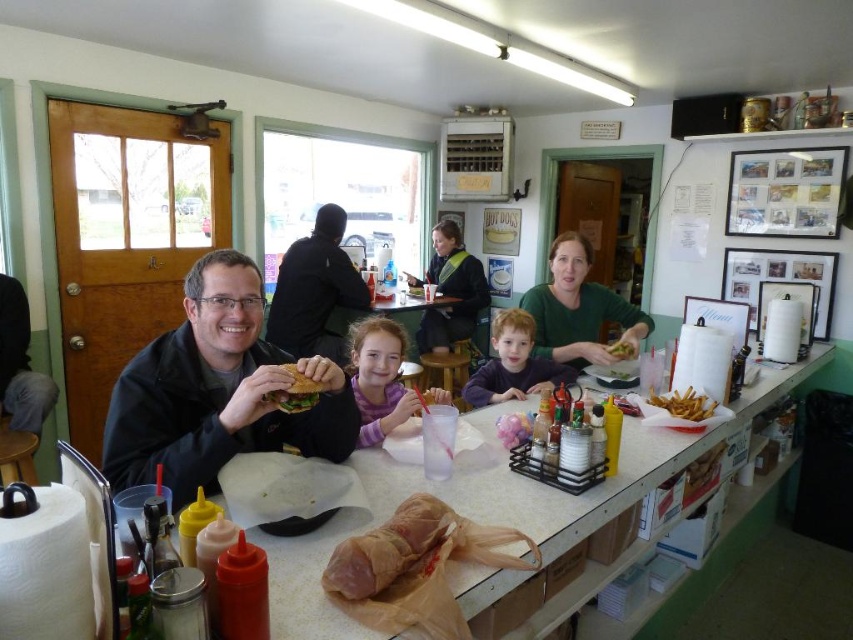
Question: Considering the relative positions of golden crispy fries at counter and matte green sandwich at center in the image provided, where is golden crispy fries at counter located with respect to matte green sandwich at center?

Choices:
 (A) below
 (B) above

Answer: (A)

Question: Which object is positioned closest to the matte brown sandwich at center?

Choices:
 (A) green fabric vest at center
 (B) matte green lettuce at center
 (C) translucent plastic bag at center
 (D) purple cotton shirt at center

Answer: (B)

Question: Which object is farther from the camera taking this photo?

Choices:
 (A) black matte jacket at center
 (B) green fabric vest at center

Answer: (B)

Question: Does purple cotton shirt at center appear under matte purple shirt at center?

Choices:
 (A) no
 (B) yes

Answer: (A)

Question: Which of the following is the closest to the observer?

Choices:
 (A) (433, 346)
 (B) (613, 310)
 (C) (503, 436)
 (D) (218, 490)

Answer: (D)

Question: Does translucent plastic bag at center have a lesser width compared to matte green sandwich at center?

Choices:
 (A) no
 (B) yes

Answer: (A)